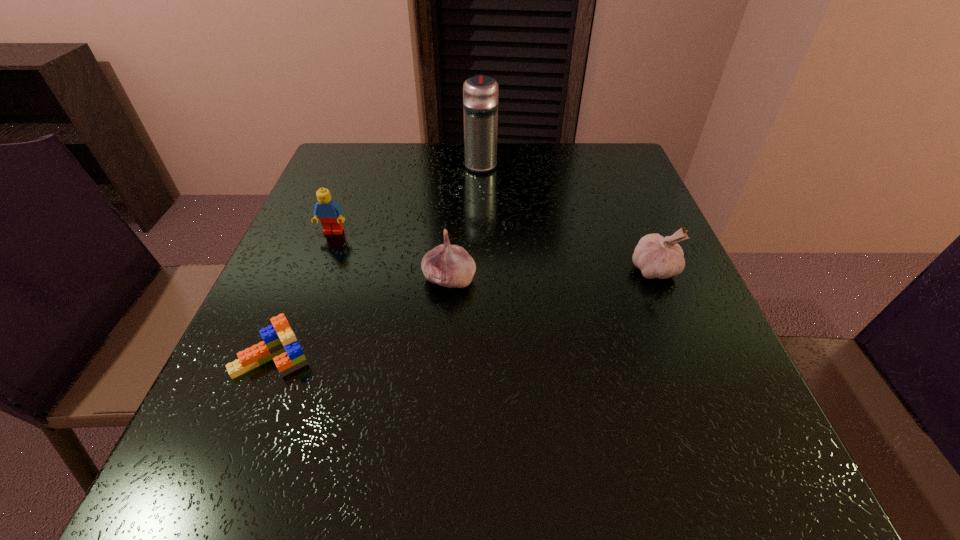
Identify the location of vacant space at the near left corner of the desktop. (230, 467).

The image size is (960, 540). In the image, there is a desktop. Identify the location of free region at the far right corner. (618, 176).

At what (x,y) coordinates should I click in order to perform the action: click on vacant space in between the rightmost object and the left garlic. Please return your answer as a coordinate pair (x, y). This screenshot has height=540, width=960. Looking at the image, I should click on pyautogui.click(x=551, y=274).

Find the location of a particular element. free space between the rightmost object and the left garlic is located at coordinates (551, 274).

You are a GUI agent. You are given a task and a screenshot of the screen. Output one action in this format:
    pyautogui.click(x=<x>, y=<y>)
    Task: Click on the free spot between the taller Lego and the rightmost object
    The width and height of the screenshot is (960, 540).
    Given the screenshot: What is the action you would take?
    pyautogui.click(x=493, y=251)

Image resolution: width=960 pixels, height=540 pixels. Identify the location of empty space that is in between the thermos bottle and the rightmost object. (567, 217).

What are the coordinates of `free area in between the left garlic and the farthest object` in the screenshot? It's located at (465, 221).

Where is `vacant area that lies between the right garlic and the taller Lego`? This screenshot has width=960, height=540. vacant area that lies between the right garlic and the taller Lego is located at coordinates (493, 251).

Where is `vacant region between the left garlic and the right garlic`? Image resolution: width=960 pixels, height=540 pixels. vacant region between the left garlic and the right garlic is located at coordinates (551, 274).

Find the location of a particular element. This screenshot has width=960, height=540. empty space that is in between the fourth nearest object and the farthest object is located at coordinates (407, 198).